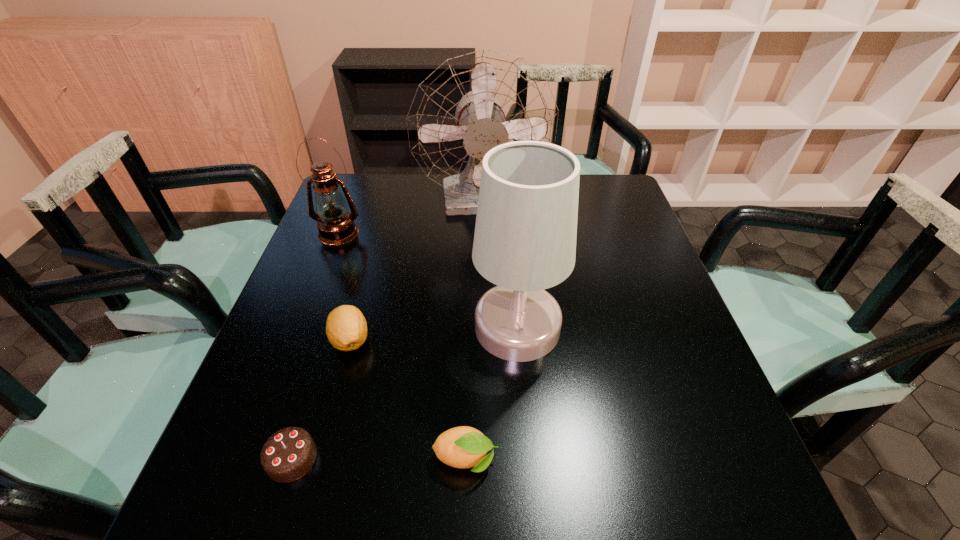
Image resolution: width=960 pixels, height=540 pixels. Find the location of `fan`. fan is located at coordinates (470, 104).

The image size is (960, 540). In order to click on lampshade in this screenshot , I will do `click(525, 234)`.

Where is `the third tallest object`? This screenshot has width=960, height=540. the third tallest object is located at coordinates (336, 226).

At what (x,y) coordinates should I click in order to perform the action: click on the left lemon. Please return your answer as a coordinate pair (x, y). Looking at the image, I should click on (346, 328).

This screenshot has height=540, width=960. Find the location of `the nearer lemon`. the nearer lemon is located at coordinates (463, 447).

Locate an element on the screen. chocolate cake is located at coordinates (289, 454).

Where is `vacant space located 0.380m in front of the fan to blow air`? Image resolution: width=960 pixels, height=540 pixels. vacant space located 0.380m in front of the fan to blow air is located at coordinates (484, 334).

I want to click on blank space located 0.360m on the base of the lampshade, so click(314, 327).

This screenshot has height=540, width=960. Identify the location of vacant space located 0.200m on the base of the lampshade. (384, 327).

Locate an element on the screen. vacant space located on the base of the lampshade is located at coordinates (438, 327).